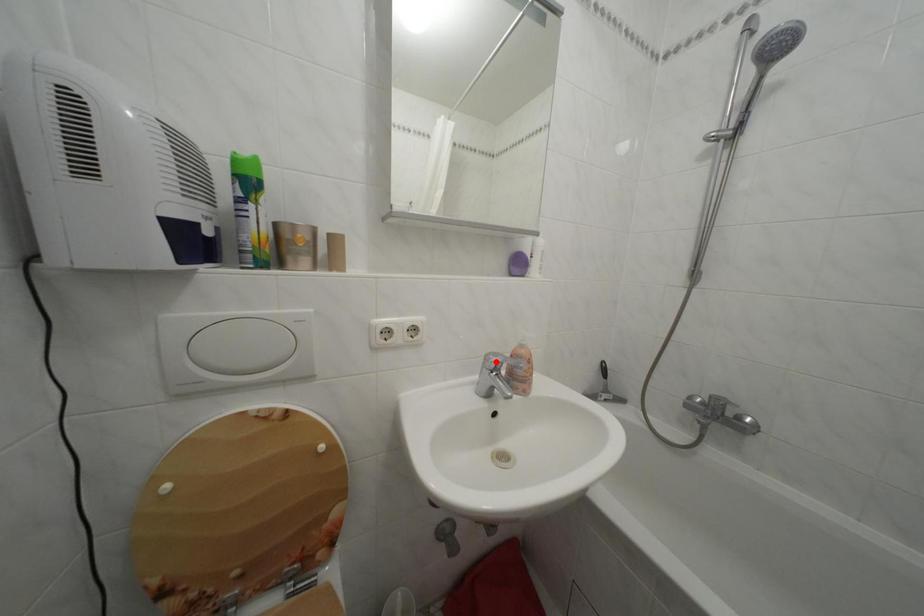
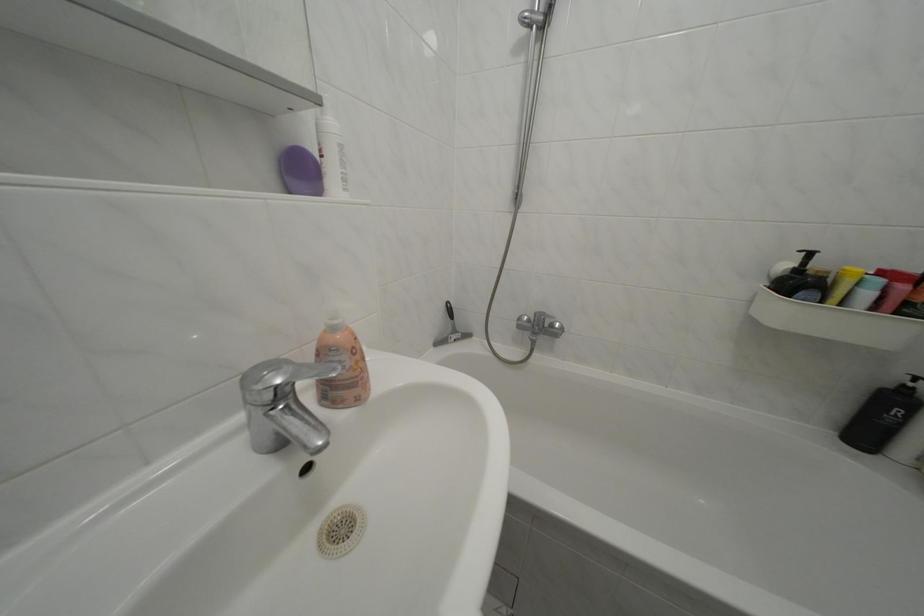
Find the pixel in the second image that matches the highlighted location in the first image.

(252, 384)